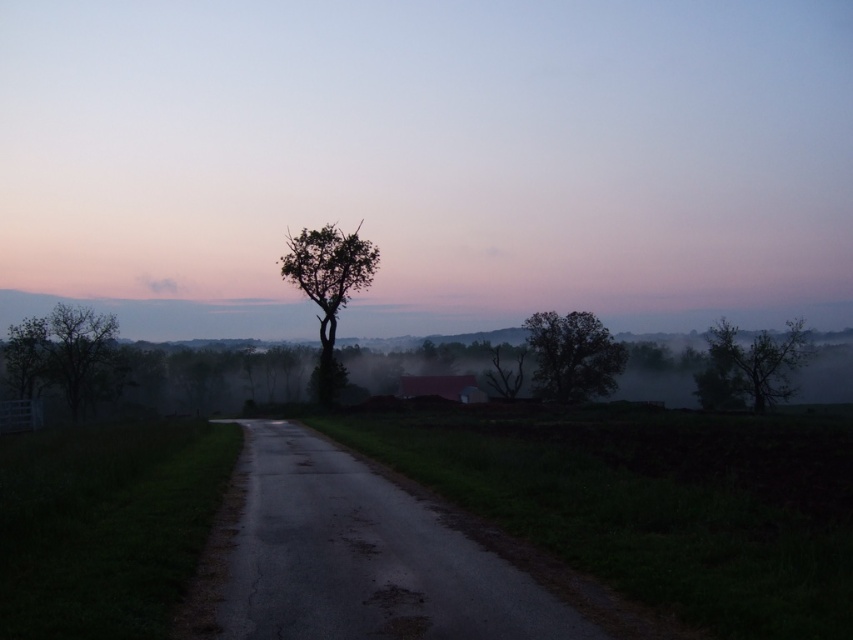
Is green leafy tree at center shorter than silhouette leafy tree at center?

Incorrect, green leafy tree at center's height does not fall short of silhouette leafy tree at center's.

Does green leafy tree at center have a lesser width compared to silhouette leafy tree at center?

No, green leafy tree at center is not thinner than silhouette leafy tree at center.

Does point (329, 269) come closer to viewer compared to point (561, 362)?

Yes, it is in front of point (561, 362).

Locate an element on the screen. green leafy tree at center is located at coordinates (328, 289).

Does green leafy tree at center appear on the right side of smooth bark tree at right?

Incorrect, green leafy tree at center is not on the right side of smooth bark tree at right.

Describe the element at coordinates (328, 289) in the screenshot. I see `green leafy tree at center` at that location.

The height and width of the screenshot is (640, 853). What are the coordinates of `green leafy tree at center` in the screenshot? It's located at (328, 289).

Between silhouette tree at center and green leafy tree at center, which one appears on the right side from the viewer's perspective?

Positioned to the right is silhouette tree at center.

Is point (488, 157) positioned after point (332, 378)?

Yes, it is.

Identify the location of silhouette tree at center. (431, 150).